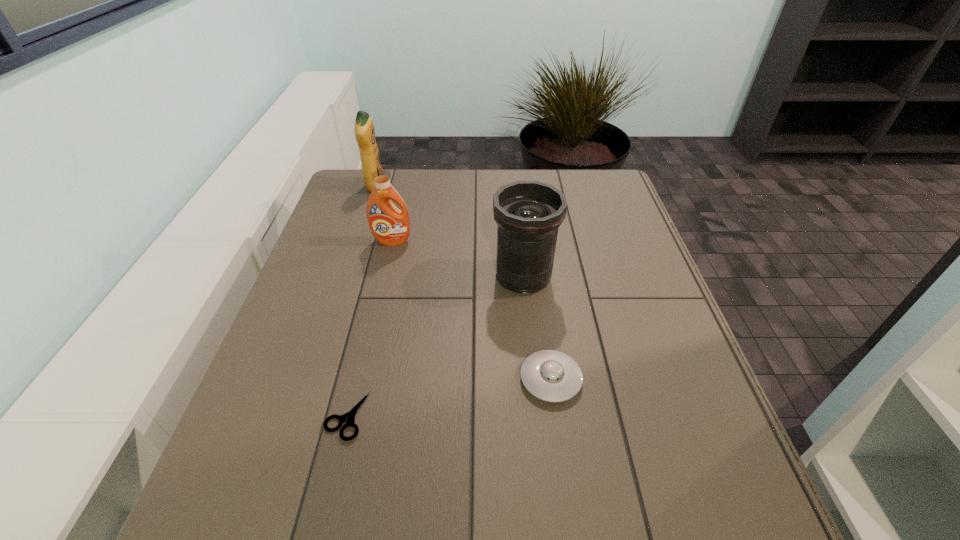
The width and height of the screenshot is (960, 540). Find the location of `unoccupied area between the third nearest object and the fourth tallest object`. unoccupied area between the third nearest object and the fourth tallest object is located at coordinates (537, 328).

This screenshot has height=540, width=960. In order to click on vacant area between the saucer and the right detergent in this screenshot , I will do `click(471, 310)`.

The image size is (960, 540). In order to click on free space between the third nearest object and the farthest object in this screenshot , I will do `click(449, 232)`.

The height and width of the screenshot is (540, 960). I want to click on free area in between the third farthest object and the shears, so click(435, 346).

The width and height of the screenshot is (960, 540). What are the coordinates of `vacant area that lies between the fourth tallest object and the shears` in the screenshot? It's located at (448, 397).

The image size is (960, 540). In order to click on vacant area between the left detergent and the saucer in this screenshot , I will do `click(463, 283)`.

Identify the location of vacant area that lies between the telephoto lens and the shears. (435, 346).

Identify the location of empty space that is in between the second shortest object and the right detergent. (471, 310).

In order to click on free space between the saucer and the shears in this screenshot , I will do `click(448, 397)`.

Where is `the third closest object relative to the farther detergent`? This screenshot has width=960, height=540. the third closest object relative to the farther detergent is located at coordinates (348, 418).